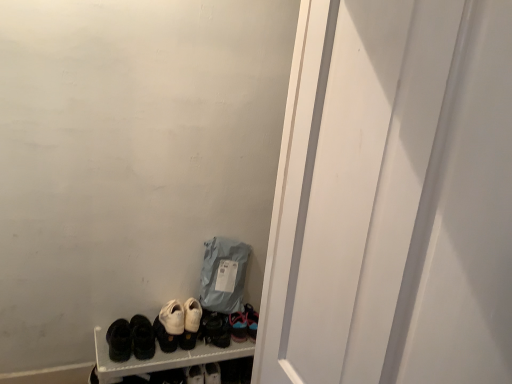
The image size is (512, 384). What do you see at coordinates (223, 275) in the screenshot?
I see `matte gray fabric bag at lower center` at bounding box center [223, 275].

Identify the location of white leather sneakers at center, which is counted as the second footwear, starting from the right. Image resolution: width=512 pixels, height=384 pixels. (190, 324).

What do you see at coordinates (190, 324) in the screenshot? The width and height of the screenshot is (512, 384). I see `white leather sneakers at center, which is counted as the fourth footwear, starting from the left` at bounding box center [190, 324].

Find the location of a particular element. This screenshot has width=512, height=384. black suede shoes at lower left, positioned as the first footwear in left-to-right order is located at coordinates (119, 340).

The width and height of the screenshot is (512, 384). Describe the element at coordinates (169, 325) in the screenshot. I see `white suede sneakers at center, which appears as the 3th footwear when viewed from the right` at that location.

Where is `matte gray fabric bag at lower center`? Image resolution: width=512 pixels, height=384 pixels. matte gray fabric bag at lower center is located at coordinates (223, 275).

Based on their sizes in the image, would you say white suede sneakers at center, which appears as the 3th footwear when viewed from the left, is bigger or smaller than black suede shoes at lower left, the second footwear from the left?

Considering their sizes, white suede sneakers at center, which appears as the 3th footwear when viewed from the left, takes up less space than black suede shoes at lower left, the second footwear from the left.

Can you confirm if white suede sneakers at center, which appears as the 3th footwear when viewed from the left, is thinner than black suede shoes at lower left, the second footwear from the left?

Yes, white suede sneakers at center, which appears as the 3th footwear when viewed from the left, is thinner than black suede shoes at lower left, the second footwear from the left.

Which of these two, white suede sneakers at center, which appears as the 3th footwear when viewed from the left, or black suede shoes at lower left, placed as the fourth footwear when sorted from right to left, stands taller?

Standing taller between the two is black suede shoes at lower left, placed as the fourth footwear when sorted from right to left.

Image resolution: width=512 pixels, height=384 pixels. I want to click on the 1st footwear behind the black suede shoes at lower left, the second footwear from the left, so click(x=169, y=325).

Considering the relative positions of black leather sneakers at center, arranged as the fifth footwear when viewed from the left, and matte gray fabric bag at lower center in the image provided, is black leather sneakers at center, arranged as the fifth footwear when viewed from the left, to the right of matte gray fabric bag at lower center from the viewer's perspective?

In fact, black leather sneakers at center, arranged as the fifth footwear when viewed from the left, is to the left of matte gray fabric bag at lower center.

Which object is closer to the camera taking this photo, black leather sneakers at center, arranged as the fifth footwear when viewed from the left, or matte gray fabric bag at lower center?

matte gray fabric bag at lower center is more forward.

Does black leather sneakers at center, arranged as the fifth footwear when viewed from the left, have a greater height compared to matte gray fabric bag at lower center?

No, black leather sneakers at center, arranged as the fifth footwear when viewed from the left, is not taller than matte gray fabric bag at lower center.

Considering the relative positions of white suede sneakers at center, which appears as the 3th footwear when viewed from the left, and matte black shoes at lower left in the image provided, is white suede sneakers at center, which appears as the 3th footwear when viewed from the left, in front of matte black shoes at lower left?

No, it is not.

Is white suede sneakers at center, which appears as the 3th footwear when viewed from the right, touching matte black shoes at lower left?

No.

Is white suede sneakers at center, which appears as the 3th footwear when viewed from the right, inside the boundaries of matte black shoes at lower left, or outside?

white suede sneakers at center, which appears as the 3th footwear when viewed from the right, exists outside the volume of matte black shoes at lower left.

Is black suede shoes at lower left, the second footwear from the left, at the back of matte gray fabric bag at lower center?

No.

Is point (234, 274) closer to viewer compared to point (144, 318)?

No, it is not.

The image size is (512, 384). I want to click on bag behind the black suede shoes at lower left, placed as the fourth footwear when sorted from right to left, so click(223, 275).

In the scene shown: What's the angular difference between white leather sneakers at center, which is counted as the fourth footwear, starting from the left, and black suede shoes at lower left, the second footwear from the left,'s facing directions?

The angle between the facing direction of white leather sneakers at center, which is counted as the fourth footwear, starting from the left, and the facing direction of black suede shoes at lower left, the second footwear from the left, is 1.47 degrees.

Find the location of a particular element. the 2nd footwear to the left when counting from the white leather sneakers at center, which is counted as the fourth footwear, starting from the left is located at coordinates (142, 337).

In terms of width, does white leather sneakers at center, which is counted as the second footwear, starting from the right, look wider or thinner when compared to black suede shoes at lower left, placed as the fourth footwear when sorted from right to left?

In the image, white leather sneakers at center, which is counted as the second footwear, starting from the right, appears to be more narrow than black suede shoes at lower left, placed as the fourth footwear when sorted from right to left.

Based on the photo, who is smaller, white leather sneakers at center, which is counted as the fourth footwear, starting from the left, or black suede shoes at lower left, placed as the fourth footwear when sorted from right to left?

With smaller size is white leather sneakers at center, which is counted as the fourth footwear, starting from the left.

Which object is thinner, white leather sneakers at center, which is counted as the fourth footwear, starting from the left, or white matte screen door at center?

white matte screen door at center is thinner.

Starting from the white matte screen door at center, which footwear is the 2nd one to the left? Please provide its 2D coordinates.

[(190, 324)]

Is white matte screen door at center surrounded by white leather sneakers at center, which is counted as the fourth footwear, starting from the left?

No.

Is the position of matte gray fabric bag at lower center more distant than that of white matte screen door at center?

Yes.

Is point (213, 285) positioned behind point (455, 172)?

Yes, it is.

Looking at this image, does matte gray fabric bag at lower center touch white matte screen door at center?

No, matte gray fabric bag at lower center is not with white matte screen door at center.

Looking at this image, looking at their sizes, would you say matte gray fabric bag at lower center is wider or thinner than white matte screen door at center?

Considering their sizes, matte gray fabric bag at lower center looks broader than white matte screen door at center.

From the image's perspective, starting from the white suede sneakers at center, which appears as the 3th footwear when viewed from the right, which footwear is the 3rd one above? Please provide its 2D coordinates.

[(142, 337)]

From the image's perspective, which footwear is the 5th one below the matte gray fabric bag at lower center? Please provide its 2D coordinates.

[(216, 329)]

When comparing their distances from black leather sneakers at center, the 1th footwear positioned from the right, does matte gray fabric bag at lower center or white suede sneakers at center, which appears as the 3th footwear when viewed from the right, seem further?

The object further to black leather sneakers at center, the 1th footwear positioned from the right, is matte gray fabric bag at lower center.

When comparing their distances from matte black shoes at lower left, does white leather sneakers at center, which is counted as the fourth footwear, starting from the left, or white matte screen door at center seem further?

white matte screen door at center.

From the picture: Considering their positions, is white matte screen door at center positioned closer to black suede shoes at lower left, the second footwear from the left, than white suede sneakers at center, which appears as the 3th footwear when viewed from the left?

white suede sneakers at center, which appears as the 3th footwear when viewed from the left, is positioned closer to the anchor black suede shoes at lower left, the second footwear from the left.

From the image, which object appears to be farther from matte gray fabric bag at lower center, black suede shoes at lower left, the second footwear from the left, or matte black shoes at lower left?

black suede shoes at lower left, the second footwear from the left, is further to matte gray fabric bag at lower center.

When comparing their distances from white matte screen door at center, does white suede sneakers at center, which appears as the 3th footwear when viewed from the left, or black suede shoes at lower left, the second footwear from the left, seem closer?

white suede sneakers at center, which appears as the 3th footwear when viewed from the left.

Based on their spatial positions, is black suede shoes at lower left, the second footwear from the left, or matte gray fabric bag at lower center further from white suede sneakers at center, which appears as the 3th footwear when viewed from the left?

matte gray fabric bag at lower center.

Based on their spatial positions, is white matte screen door at center or black suede shoes at lower left, positioned as the first footwear in left-to-right order, further from black leather sneakers at center, the 1th footwear positioned from the right?

white matte screen door at center lies further to black leather sneakers at center, the 1th footwear positioned from the right, than the other object.

Which object lies nearer to the anchor point black suede shoes at lower left, placed as the 5th footwear when sorted from right to left, black suede shoes at lower left, the second footwear from the left, or matte gray fabric bag at lower center?

black suede shoes at lower left, the second footwear from the left, is positioned closer to the anchor black suede shoes at lower left, placed as the 5th footwear when sorted from right to left.

Where is `footwear between white suede sneakers at center, which appears as the 3th footwear when viewed from the left, and matte black shoes at lower left, in the vertical direction`? This screenshot has width=512, height=384. footwear between white suede sneakers at center, which appears as the 3th footwear when viewed from the left, and matte black shoes at lower left, in the vertical direction is located at coordinates (216, 329).

Locate an element on the screen. This screenshot has width=512, height=384. bag located between white matte screen door at center and white leather sneakers at center, which is counted as the fourth footwear, starting from the left, in the depth direction is located at coordinates (223, 275).

You are a GUI agent. You are given a task and a screenshot of the screen. Output one action in this format:
    pyautogui.click(x=<x>, y=<y>)
    Task: Click on the bookshelf between black suede shoes at lower left, placed as the fourth footwear when sorted from right to left, and black leather sneakers at center, arranged as the fifth footwear when viewed from the left, from left to right
    
    Given the screenshot: What is the action you would take?
    pyautogui.click(x=162, y=358)

Find the location of a particular element. bookshelf between black suede shoes at lower left, positioned as the first footwear in left-to-right order, and black leather sneakers at center, the 1th footwear positioned from the right is located at coordinates (162, 358).